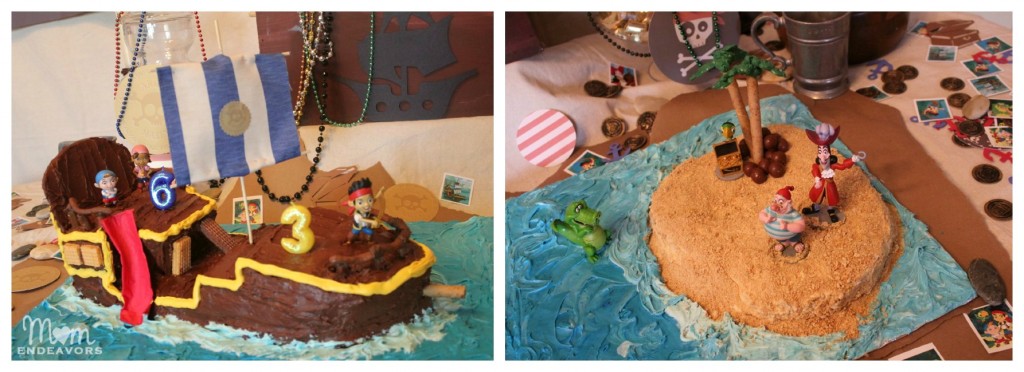
Where is `toy`? This screenshot has height=372, width=1024. toy is located at coordinates (772, 218).